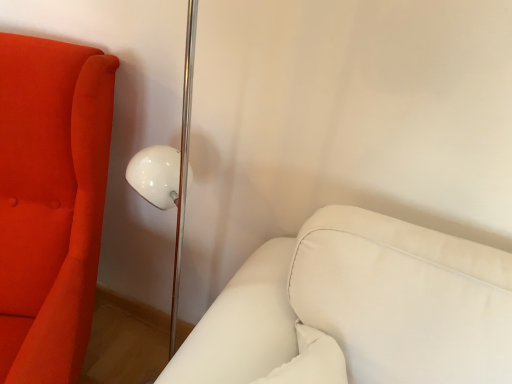
Question: Is white leather couch at lower right, the second furniture from the left, further to the viewer compared to matte orange sofa at left, the 2th furniture in the right-to-left sequence?

Choices:
 (A) no
 (B) yes

Answer: (B)

Question: Is white leather couch at lower right, positioned as the first furniture in right-to-left order, facing away from matte orange sofa at left, placed as the 1th furniture when sorted from left to right?

Choices:
 (A) no
 (B) yes

Answer: (B)

Question: From the image's perspective, does white leather couch at lower right, positioned as the first furniture in right-to-left order, appear lower than matte orange sofa at left, placed as the 1th furniture when sorted from left to right?

Choices:
 (A) no
 (B) yes

Answer: (B)

Question: Is white leather couch at lower right, the second furniture from the left, thinner than matte orange sofa at left, placed as the 1th furniture when sorted from left to right?

Choices:
 (A) no
 (B) yes

Answer: (B)

Question: Considering the relative sizes of white leather couch at lower right, the second furniture from the left, and matte orange sofa at left, placed as the 1th furniture when sorted from left to right, in the image provided, is white leather couch at lower right, the second furniture from the left, taller than matte orange sofa at left, placed as the 1th furniture when sorted from left to right,?

Choices:
 (A) no
 (B) yes

Answer: (A)

Question: From a real-world perspective, is white leather couch at lower right, the second furniture from the left, located higher than matte orange sofa at left, the 2th furniture in the right-to-left sequence?

Choices:
 (A) yes
 (B) no

Answer: (A)

Question: From the image's perspective, does matte orange sofa at left, placed as the 1th furniture when sorted from left to right, appear lower than white leather couch at lower right, positioned as the first furniture in right-to-left order?

Choices:
 (A) no
 (B) yes

Answer: (A)

Question: Is matte orange sofa at left, the 2th furniture in the right-to-left sequence, facing away from white leather couch at lower right, positioned as the first furniture in right-to-left order?

Choices:
 (A) yes
 (B) no

Answer: (B)

Question: Does matte orange sofa at left, the 2th furniture in the right-to-left sequence, lie in front of white leather couch at lower right, positioned as the first furniture in right-to-left order?

Choices:
 (A) no
 (B) yes

Answer: (B)

Question: From a real-world perspective, is matte orange sofa at left, the 2th furniture in the right-to-left sequence, located higher than white leather couch at lower right, positioned as the first furniture in right-to-left order?

Choices:
 (A) no
 (B) yes

Answer: (A)

Question: Does matte orange sofa at left, the 2th furniture in the right-to-left sequence, have a greater width compared to white leather couch at lower right, positioned as the first furniture in right-to-left order?

Choices:
 (A) yes
 (B) no

Answer: (A)

Question: Is matte orange sofa at left, placed as the 1th furniture when sorted from left to right, taller than white leather couch at lower right, positioned as the first furniture in right-to-left order?

Choices:
 (A) no
 (B) yes

Answer: (B)

Question: Based on their positions, is white leather couch at lower right, positioned as the first furniture in right-to-left order, located to the left or right of matte orange sofa at left, the 2th furniture in the right-to-left sequence?

Choices:
 (A) right
 (B) left

Answer: (A)